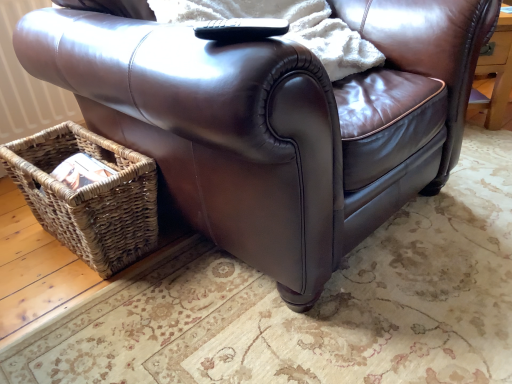
Question: Is black plastic remote at upper center smaller than woven brown picnic basket at lower left?

Choices:
 (A) yes
 (B) no

Answer: (A)

Question: Is black plastic remote at upper center wider than woven brown picnic basket at lower left?

Choices:
 (A) yes
 (B) no

Answer: (B)

Question: Is black plastic remote at upper center thinner than woven brown picnic basket at lower left?

Choices:
 (A) no
 (B) yes

Answer: (B)

Question: From the image's perspective, is black plastic remote at upper center on woven brown picnic basket at lower left?

Choices:
 (A) yes
 (B) no

Answer: (A)

Question: Does black plastic remote at upper center have a lesser height compared to woven brown picnic basket at lower left?

Choices:
 (A) no
 (B) yes

Answer: (B)

Question: From the image's perspective, is black plastic remote at upper center below woven brown picnic basket at lower left?

Choices:
 (A) no
 (B) yes

Answer: (A)

Question: Can you confirm if woven brown picnic basket at lower left is smaller than black plastic remote at upper center?

Choices:
 (A) yes
 (B) no

Answer: (B)

Question: Is woven brown picnic basket at lower left directly adjacent to black plastic remote at upper center?

Choices:
 (A) no
 (B) yes

Answer: (A)

Question: Is woven brown picnic basket at lower left positioned before black plastic remote at upper center?

Choices:
 (A) yes
 (B) no

Answer: (B)

Question: From a real-world perspective, does woven brown picnic basket at lower left stand above black plastic remote at upper center?

Choices:
 (A) yes
 (B) no

Answer: (B)

Question: Does woven brown picnic basket at lower left have a lesser height compared to black plastic remote at upper center?

Choices:
 (A) yes
 (B) no

Answer: (B)

Question: Is woven brown picnic basket at lower left to the right of black plastic remote at upper center from the viewer's perspective?

Choices:
 (A) yes
 (B) no

Answer: (B)

Question: Based on their sizes in the image, would you say woven brown picnic basket at lower left is bigger or smaller than black plastic remote at upper center?

Choices:
 (A) small
 (B) big

Answer: (B)